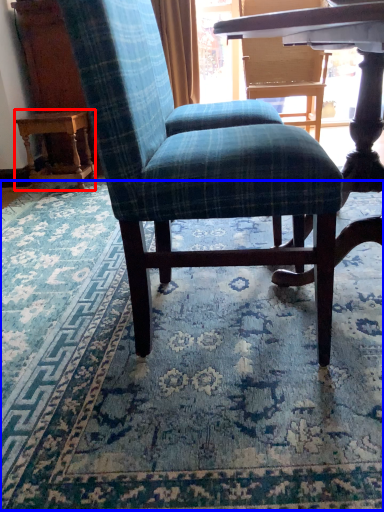
Question: Which object appears closest to the camera in this image, table (highlighted by a red box) or mat (highlighted by a blue box)?

Choices:
 (A) table
 (B) mat

Answer: (B)